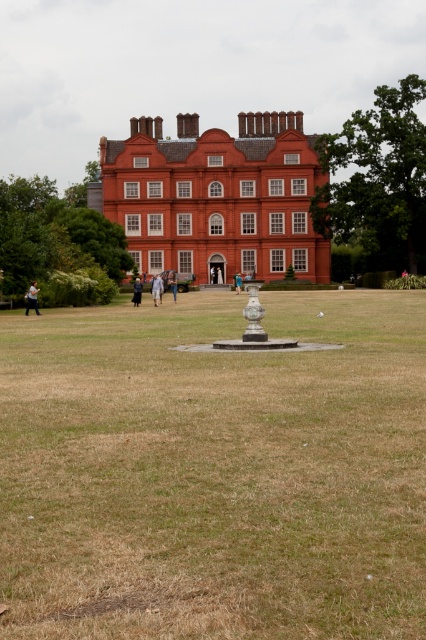
Question: Is light blue denim jacket at center thinner than light blue fabric at center?

Choices:
 (A) no
 (B) yes

Answer: (A)

Question: Considering the real-world distances, which object is closest to the light blue denim jacket at center?

Choices:
 (A) brown grass at center
 (B) dark gray fabric coat at center

Answer: (B)

Question: Is dark gray fabric coat at center closer to camera compared to light blue fabric at center?

Choices:
 (A) no
 (B) yes

Answer: (B)

Question: Does dark gray fabric coat at center have a greater width compared to light brown leather jacket at center?

Choices:
 (A) no
 (B) yes

Answer: (B)

Question: Estimate the real-world distances between objects in this image. Which object is closer to the brown grass at center?

Choices:
 (A) light brown fabric jacket at lower left
 (B) dark gray fabric coat at center
 (C) light brown leather jacket at center
 (D) light blue fabric at center

Answer: (A)

Question: Which object is farther from the camera taking this photo?

Choices:
 (A) light brown fabric jacket at lower left
 (B) light blue denim jacket at center
 (C) light blue fabric at center

Answer: (C)